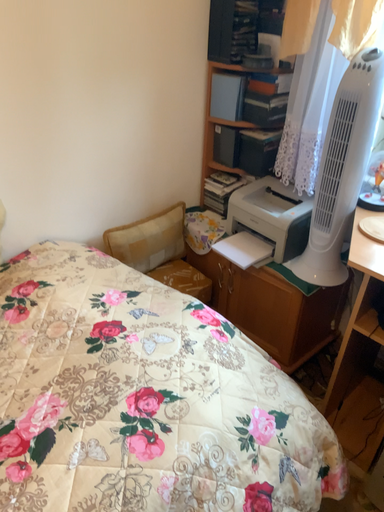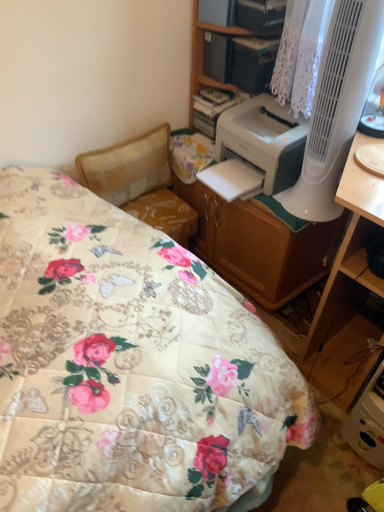
Question: How did the camera likely rotate when shooting the video?

Choices:
 (A) rotated downward
 (B) rotated upward

Answer: (A)